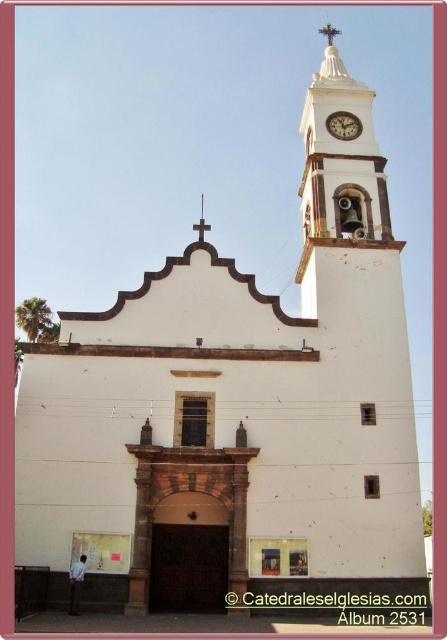
Question: Is white stucco clock tower at upper center smaller than metallic cross at upper center?

Choices:
 (A) yes
 (B) no

Answer: (B)

Question: Which object is closer to the camera taking this photo?

Choices:
 (A) metallic clock at upper center
 (B) metallic cross at upper center
 (C) white stucco clock tower at upper center

Answer: (C)

Question: Does white stucco clock tower at upper center have a lesser width compared to metallic clock at upper center?

Choices:
 (A) yes
 (B) no

Answer: (B)

Question: Which object is positioned farthest from the metallic cross at upper center?

Choices:
 (A) metallic clock at upper center
 (B) white stucco clock tower at upper center

Answer: (A)

Question: Which of the following is the farthest from the observer?

Choices:
 (A) (303, 141)
 (B) (333, 124)

Answer: (A)

Question: From the image, what is the correct spatial relationship of white stucco clock tower at upper center in relation to metallic cross at upper center?

Choices:
 (A) right
 (B) left

Answer: (A)